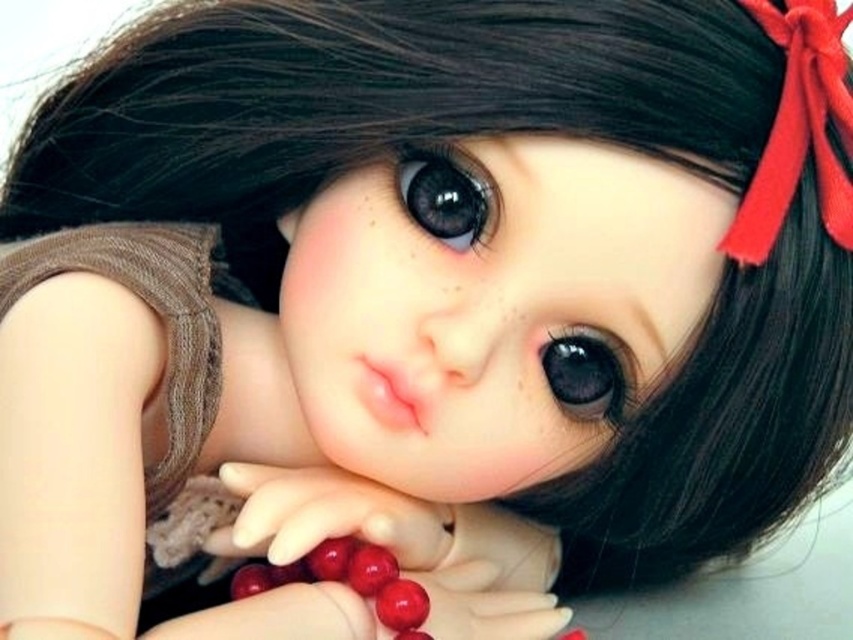
Consider the image. Does smooth plastic beads at center have a larger size compared to glossy red berry at center?

Yes, smooth plastic beads at center is bigger than glossy red berry at center.

Does smooth plastic beads at center have a greater width compared to glossy red berry at center?

Indeed, smooth plastic beads at center has a greater width compared to glossy red berry at center.

Image resolution: width=853 pixels, height=640 pixels. Describe the element at coordinates (328, 515) in the screenshot. I see `smooth plastic beads at center` at that location.

Where is `smooth plastic beads at center`? smooth plastic beads at center is located at coordinates (328, 515).

Find the location of `shiny red beads at center`. shiny red beads at center is located at coordinates (347, 580).

Can you confirm if shiny red beads at center is shorter than glossy red berry at center?

Incorrect, shiny red beads at center's height does not fall short of glossy red berry at center's.

What are the coordinates of `shiny red beads at center` in the screenshot? It's located at (347, 580).

Find the location of a particular element. This screenshot has height=640, width=853. shiny red beads at center is located at coordinates (347, 580).

Does smooth plastic beads at center appear over shiny red beads at center?

Indeed, smooth plastic beads at center is positioned over shiny red beads at center.

Which is more to the left, smooth plastic beads at center or shiny red beads at center?

shiny red beads at center

Locate an element on the screen. smooth plastic beads at center is located at coordinates (328, 515).